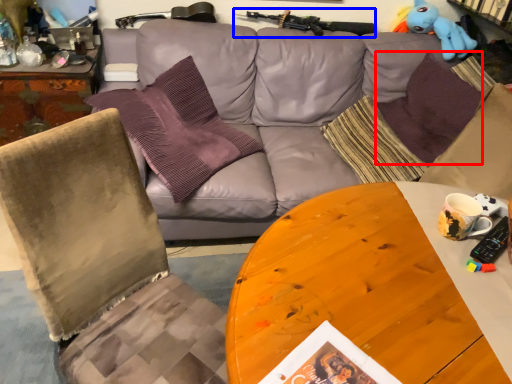
Question: Which point is closer to the camera, pillow (highlighted by a red box) or gun (highlighted by a blue box)?

Choices:
 (A) pillow
 (B) gun

Answer: (A)